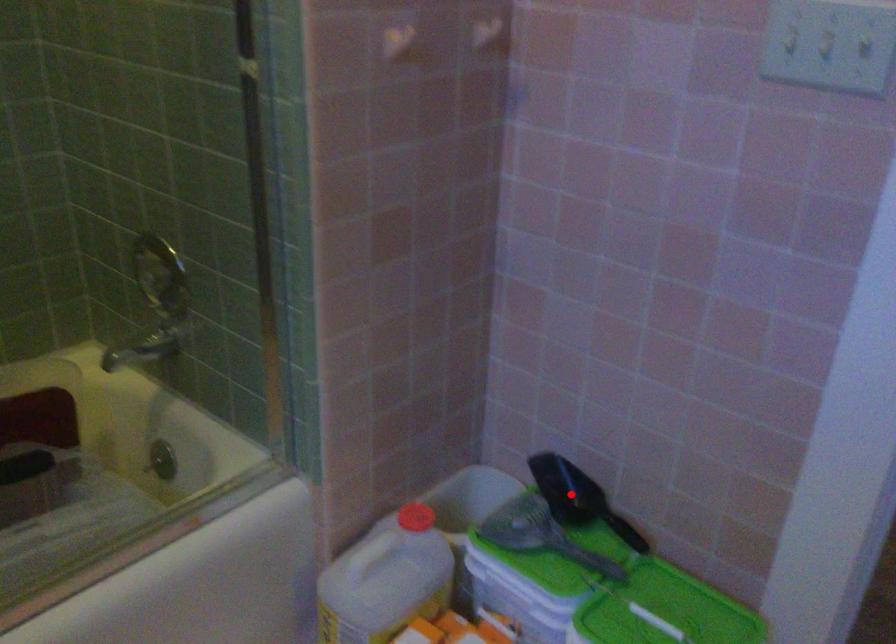
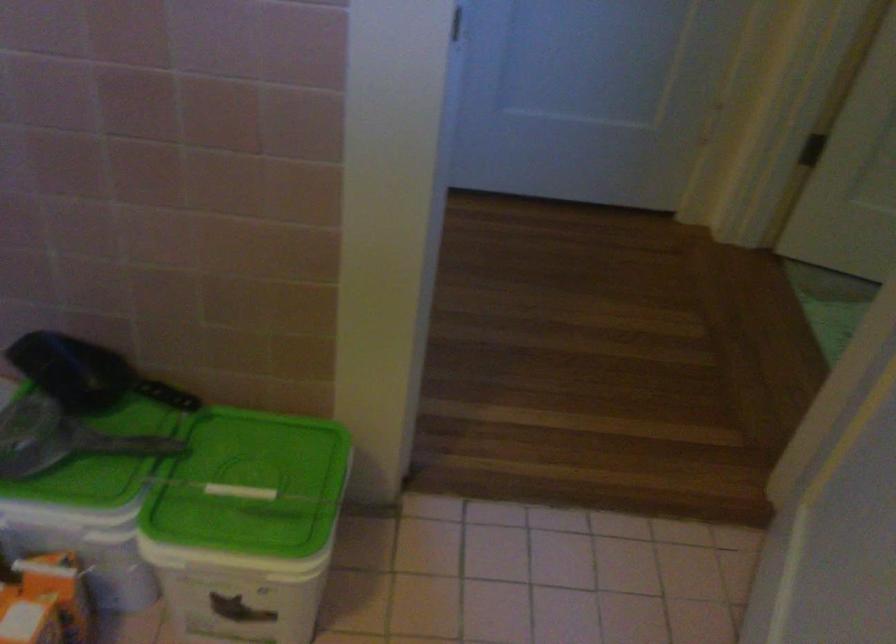
Question: I am providing you with two images of the same scene from different viewpoints. A red point is shown in image1. For the corresponding object point in image2, is it positioned nearer or farther from the camera?

Choices:
 (A) Nearer
 (B) Farther

Answer: (A)